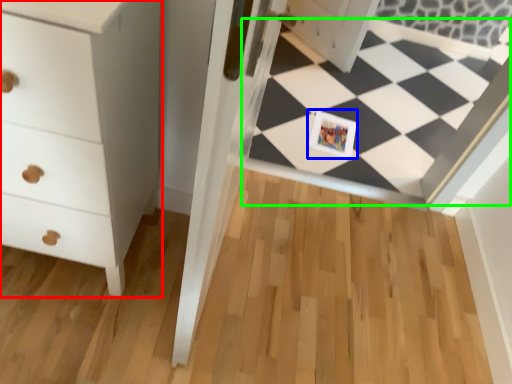
Question: Which object is positioned farthest from chest of drawers (highlighted by a red box)? Select from postcard (highlighted by a blue box) and square (highlighted by a green box).

Choices:
 (A) postcard
 (B) square

Answer: (B)